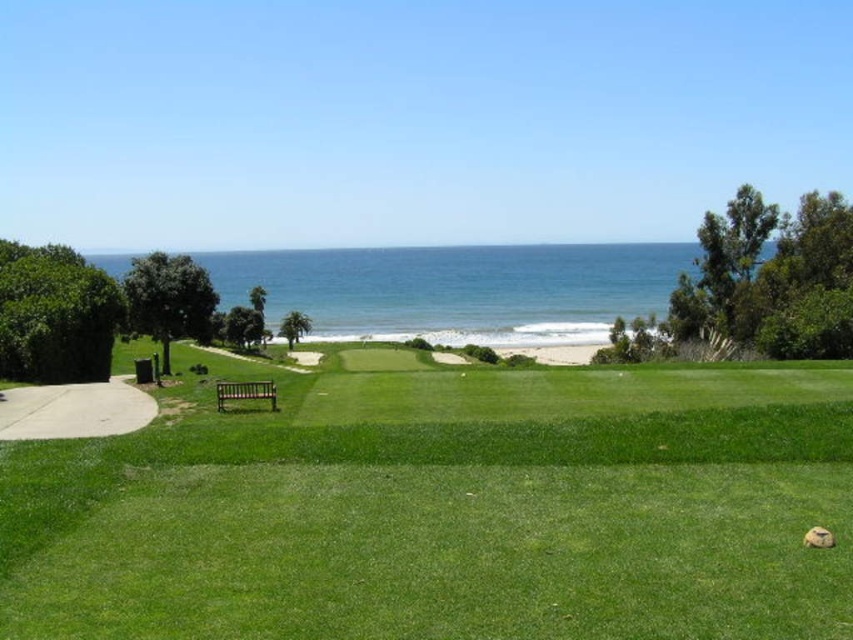
Does point (520, 257) come farther from viewer compared to point (227, 385)?

Yes, point (520, 257) is behind point (227, 385).

Which is behind, point (532, 316) or point (241, 396)?

The point (532, 316) is behind.

Where is `blue water at center`? This screenshot has width=853, height=640. blue water at center is located at coordinates (457, 289).

Who is more forward, (x=126, y=355) or (x=498, y=342)?

Positioned in front is point (x=126, y=355).

Can you confirm if green smooth grass at center is wider than blue water at center?

No, green smooth grass at center is not wider than blue water at center.

Who is more distant from viewer, (233,515) or (589,323)?

The point (589,323) is behind.

This screenshot has height=640, width=853. In order to click on green smooth grass at center in this screenshot , I will do `click(445, 508)`.

This screenshot has width=853, height=640. I want to click on blue water at center, so click(x=457, y=289).

Locate an element on the screen. blue water at center is located at coordinates (457, 289).

The width and height of the screenshot is (853, 640). Find the location of `blue water at center`. blue water at center is located at coordinates (457, 289).